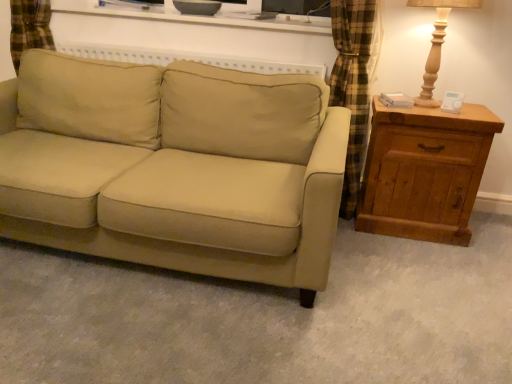
Question: From the image's perspective, is beige fabric couch at center located beneath matte white shelf at upper center?

Choices:
 (A) yes
 (B) no

Answer: (A)

Question: Considering the relative sizes of beige fabric couch at center and matte white shelf at upper center in the image provided, is beige fabric couch at center smaller than matte white shelf at upper center?

Choices:
 (A) yes
 (B) no

Answer: (B)

Question: Could you tell me if beige fabric couch at center is facing matte white shelf at upper center?

Choices:
 (A) no
 (B) yes

Answer: (A)

Question: Is beige fabric couch at center thinner than matte white shelf at upper center?

Choices:
 (A) no
 (B) yes

Answer: (A)

Question: Is beige fabric couch at center taller than matte white shelf at upper center?

Choices:
 (A) yes
 (B) no

Answer: (A)

Question: Is beige fabric couch at center positioned far away from matte white shelf at upper center?

Choices:
 (A) no
 (B) yes

Answer: (A)

Question: Does beige fabric couch at center have a larger size compared to wooden table lamp at right?

Choices:
 (A) yes
 (B) no

Answer: (A)

Question: Is beige fabric couch at center not inside wooden table lamp at right?

Choices:
 (A) yes
 (B) no

Answer: (A)

Question: From the image's perspective, is beige fabric couch at center located beneath wooden table lamp at right?

Choices:
 (A) no
 (B) yes

Answer: (B)

Question: Are beige fabric couch at center and wooden table lamp at right beside each other?

Choices:
 (A) no
 (B) yes

Answer: (A)

Question: From a real-world perspective, is beige fabric couch at center under wooden table lamp at right?

Choices:
 (A) yes
 (B) no

Answer: (A)

Question: Considering the relative positions of beige fabric couch at center and wooden table lamp at right in the image provided, is beige fabric couch at center behind wooden table lamp at right?

Choices:
 (A) no
 (B) yes

Answer: (A)

Question: Can you confirm if wooden table lamp at right is shorter than wooden chest of drawers at right?

Choices:
 (A) no
 (B) yes

Answer: (B)